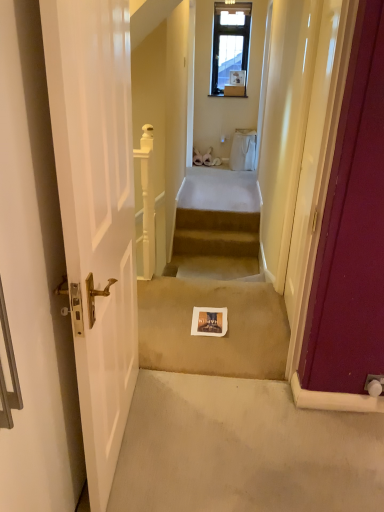
Question: Is white paper at center at the left side of beige carpeted stairs at center?

Choices:
 (A) yes
 (B) no

Answer: (A)

Question: Is white paper at center bigger than beige carpeted stairs at center?

Choices:
 (A) yes
 (B) no

Answer: (A)

Question: Considering the relative sizes of white paper at center and beige carpeted stairs at center in the image provided, is white paper at center thinner than beige carpeted stairs at center?

Choices:
 (A) no
 (B) yes

Answer: (A)

Question: Is white paper at center turned away from beige carpeted stairs at center?

Choices:
 (A) yes
 (B) no

Answer: (B)

Question: Is white paper at center facing towards beige carpeted stairs at center?

Choices:
 (A) yes
 (B) no

Answer: (B)

Question: Considering the relative sizes of white paper at center and beige carpeted stairs at center in the image provided, is white paper at center taller than beige carpeted stairs at center?

Choices:
 (A) no
 (B) yes

Answer: (A)

Question: Can you confirm if beige carpeted stairs at center is taller than white paper at center?

Choices:
 (A) no
 (B) yes

Answer: (B)

Question: Is beige carpeted stairs at center surrounding white paper at center?

Choices:
 (A) no
 (B) yes

Answer: (A)

Question: Does beige carpeted stairs at center have a larger size compared to white paper at center?

Choices:
 (A) yes
 (B) no

Answer: (B)

Question: Is beige carpeted stairs at center facing towards white paper at center?

Choices:
 (A) yes
 (B) no

Answer: (A)

Question: Can you confirm if beige carpeted stairs at center is positioned to the left of white paper at center?

Choices:
 (A) no
 (B) yes

Answer: (A)

Question: From a real-world perspective, is beige carpeted stairs at center on white paper at center?

Choices:
 (A) yes
 (B) no

Answer: (B)

Question: Is matte burgundy door at right, which is the first door in right-to-left order, oriented towards white paper at center?

Choices:
 (A) no
 (B) yes

Answer: (B)